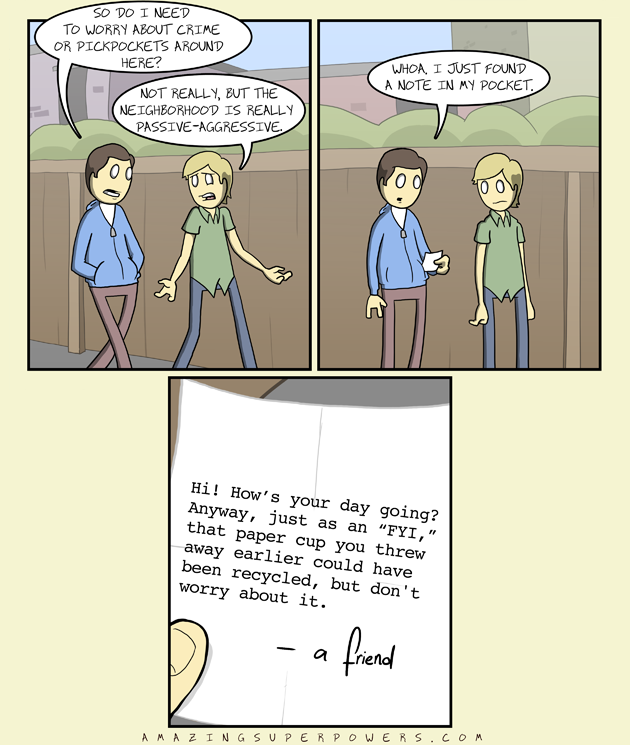
Locate an element on the screen. corner is located at coordinates (448, 378), (596, 367), (30, 21).